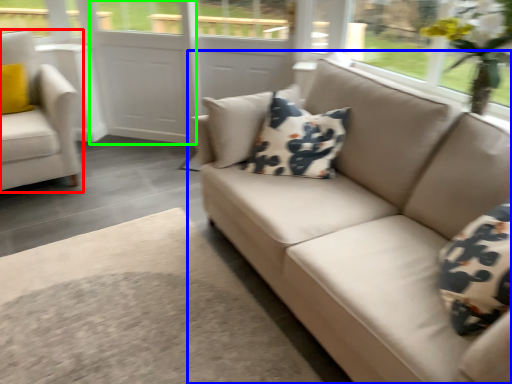
Question: Which object is the closest to the chair (highlighted by a red box)? Choose among these: studio couch (highlighted by a blue box) or screen door (highlighted by a green box).

Choices:
 (A) studio couch
 (B) screen door

Answer: (B)